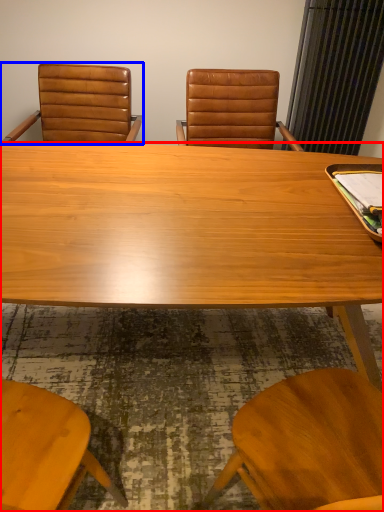
Question: Which point is closer to the camera, desk (highlighted by a red box) or chair (highlighted by a blue box)?

Choices:
 (A) desk
 (B) chair

Answer: (A)